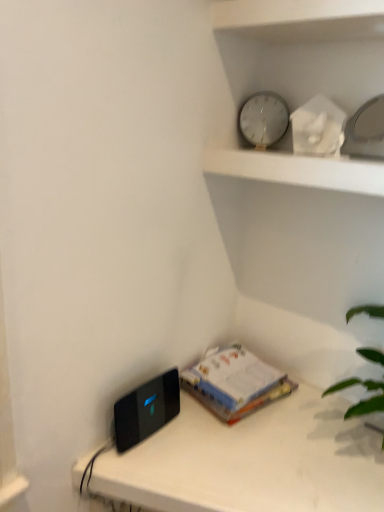
The image size is (384, 512). I want to click on vacant space to the right of black glossy ipod at lower left, so click(195, 438).